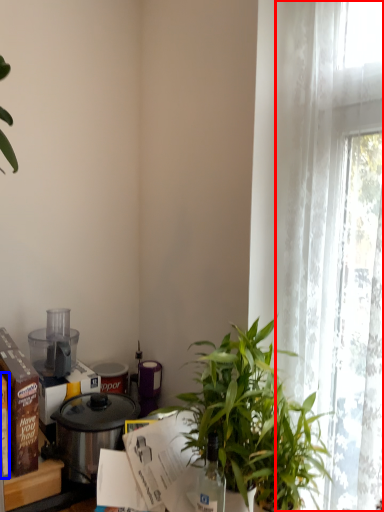
Question: Which of the following is the farthest to the observer, curtain (highlighted by a red box) or box (highlighted by a blue box)?

Choices:
 (A) curtain
 (B) box

Answer: (B)